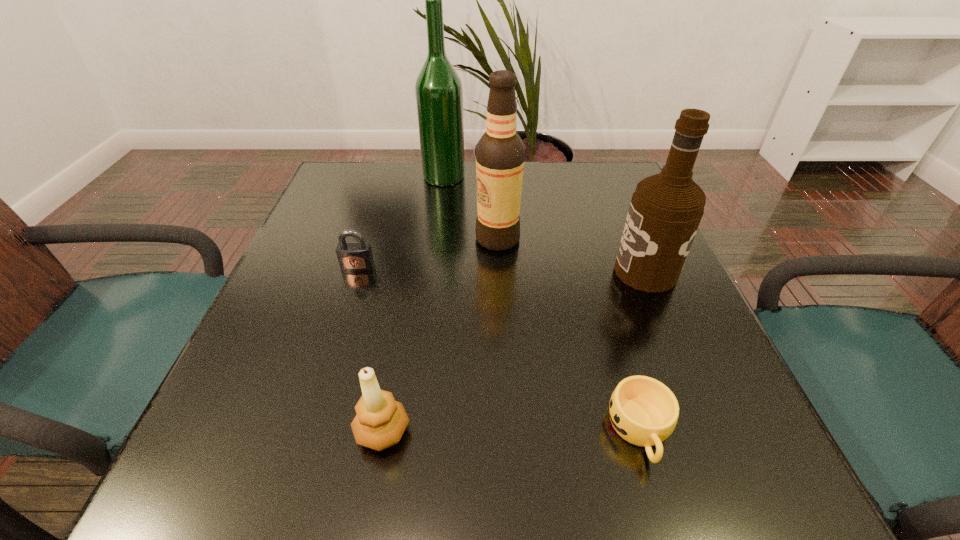
This screenshot has height=540, width=960. Identify the location of the leftmost alcohol. (438, 88).

Locate an element on the screen. The width and height of the screenshot is (960, 540). the tallest alcohol is located at coordinates (438, 88).

Where is `the second alcohol from left to right`? the second alcohol from left to right is located at coordinates (500, 153).

Identify the location of the rightmost alcohol. This screenshot has width=960, height=540. (666, 209).

Where is `candle_holder`? This screenshot has width=960, height=540. candle_holder is located at coordinates (380, 421).

At what (x,y) coordinates should I click in order to perform the action: click on padlock. Please return your answer as a coordinate pair (x, y). Looking at the image, I should click on click(x=353, y=256).

In order to click on the leftmost object in this screenshot , I will do `click(353, 256)`.

Identify the location of the shortest object. The image size is (960, 540). (643, 411).

I want to click on vacant space located on the front of the leftmost alcohol, so click(440, 208).

You are a GUI agent. You are given a task and a screenshot of the screen. Output one action in this format:
    pyautogui.click(x=<x>, y=<y>)
    Task: Click on the free region located on the label of the fourth object from left to right
    The image size is (960, 540).
    Given the screenshot: What is the action you would take?
    pyautogui.click(x=398, y=239)